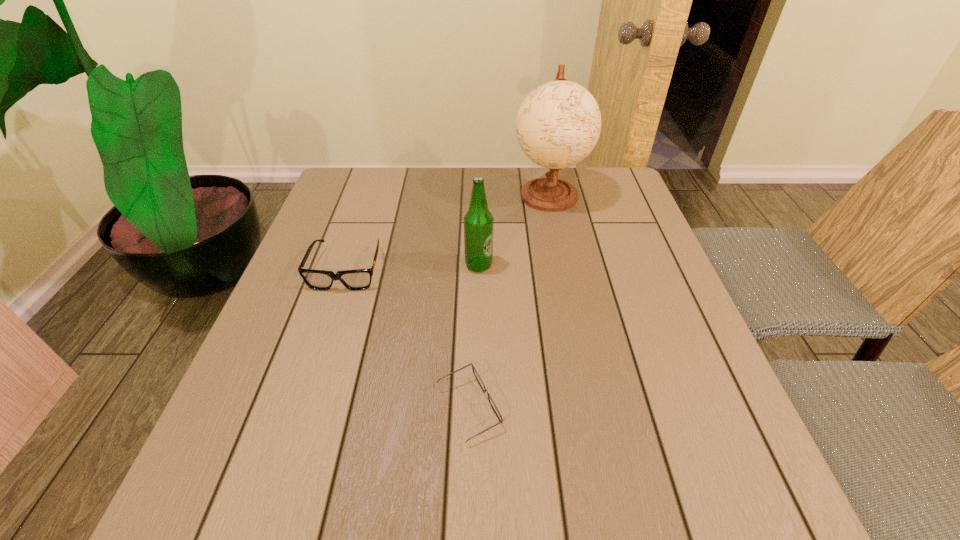
The width and height of the screenshot is (960, 540). I want to click on the farthest object, so click(x=558, y=124).

Find the location of a particular element. This screenshot has height=540, width=960. the rightmost object is located at coordinates (558, 124).

This screenshot has width=960, height=540. I want to click on the second tallest object, so click(478, 222).

Identify the location of the second shortest object. The width and height of the screenshot is (960, 540). (360, 279).

At what (x,y) coordinates should I click in order to perform the action: click on sunglasses. Please return your answer as a coordinate pair (x, y). Looking at the image, I should click on (360, 279).

Identify the location of the shortest object. (476, 374).

Locate an element on the screen. The image size is (960, 540). spectacles is located at coordinates click(x=476, y=374).

I want to click on free space located on the surface of the globe, so click(x=574, y=318).

The width and height of the screenshot is (960, 540). What are the coordinates of `vacant space positioned on the label of the beer bottle` in the screenshot? It's located at (534, 265).

Where is `vacant space located 0.160m on the front-facing side of the third tallest object`? vacant space located 0.160m on the front-facing side of the third tallest object is located at coordinates (321, 349).